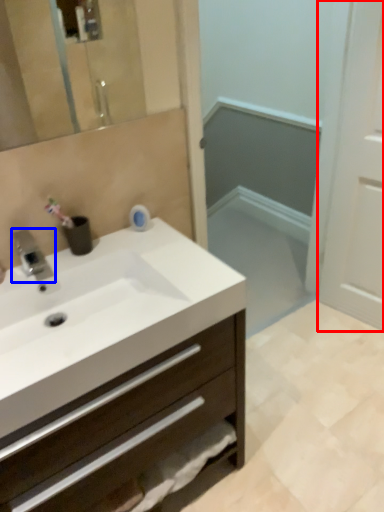
Question: Which object is further to the camera taking this photo, screen door (highlighted by a red box) or tap (highlighted by a blue box)?

Choices:
 (A) screen door
 (B) tap

Answer: (A)